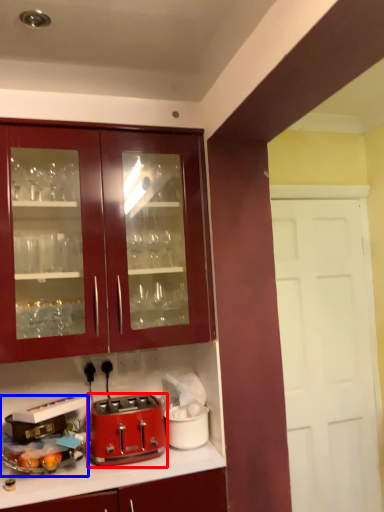
Question: Which object is closer to the camera taking this photo, toaster (highlighted by a red box) or appliance (highlighted by a blue box)?

Choices:
 (A) toaster
 (B) appliance

Answer: (B)